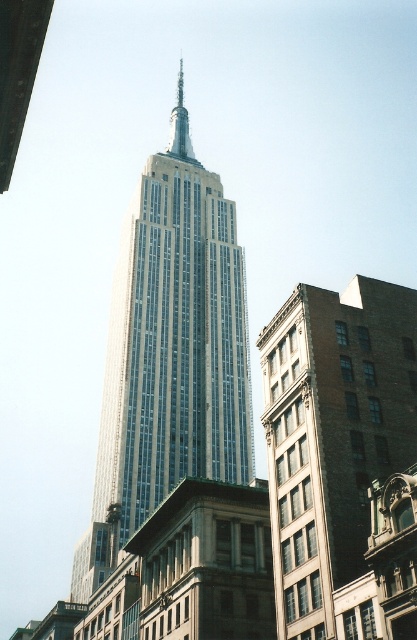
Between glassy steel tower at center and brown brick building at lower right, which one appears on the right side from the viewer's perspective?

brown brick building at lower right is more to the right.

Does glassy steel tower at center have a greater height compared to brown brick building at lower right?

Correct, glassy steel tower at center is much taller as brown brick building at lower right.

Which is in front, point (176, 316) or point (323, 586)?

Point (323, 586) is in front.

I want to click on glassy steel tower at center, so click(168, 353).